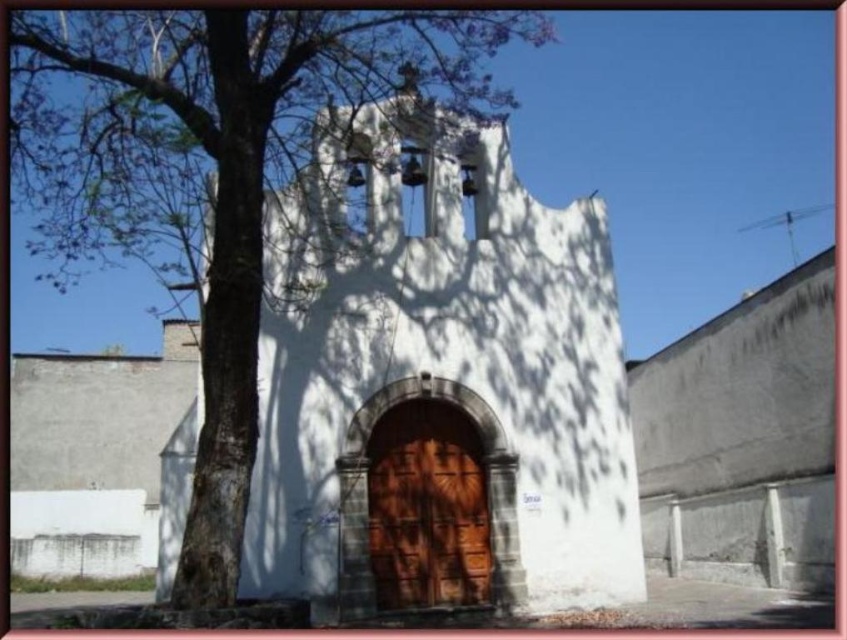
Question: Which point is farther to the camera?

Choices:
 (A) (452, 440)
 (B) (234, 99)

Answer: (A)

Question: Is green leafy tree at left below brown wooden door at center?

Choices:
 (A) yes
 (B) no

Answer: (B)

Question: Does green leafy tree at left have a greater width compared to brown wooden door at center?

Choices:
 (A) yes
 (B) no

Answer: (A)

Question: Which object is farther from the camera taking this photo?

Choices:
 (A) brown wooden door at center
 (B) green leafy tree at left

Answer: (A)

Question: Among these points, which one is nearest to the camera?

Choices:
 (A) (421, 504)
 (B) (242, 131)

Answer: (B)

Question: Does green leafy tree at left appear on the left side of brown wooden door at center?

Choices:
 (A) no
 (B) yes

Answer: (B)